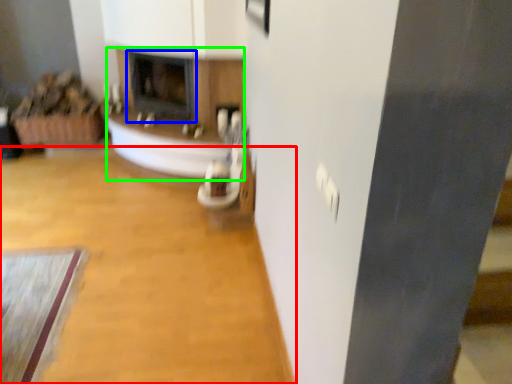
Question: Estimate the real-world distances between objects in this image. Which object is farther from plain (highlighted by a red box), fireplace (highlighted by a blue box) or fireplace (highlighted by a green box)?

Choices:
 (A) fireplace
 (B) fireplace

Answer: (A)